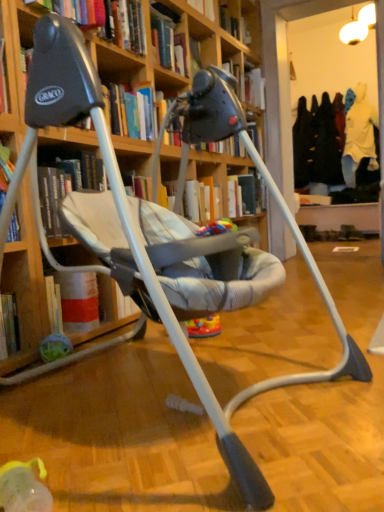
Where is `hardcover book at upper center, which appears as the second book when viewed from the back`? Image resolution: width=384 pixels, height=512 pixels. hardcover book at upper center, which appears as the second book when viewed from the back is located at coordinates (131, 112).

The image size is (384, 512). What do you see at coordinates (217, 228) in the screenshot?
I see `multicolored plastic toy at center` at bounding box center [217, 228].

Measure the distance between point (134, 336) and camera.

Point (134, 336) and camera are 1.67 meters apart from each other.

What do you see at coordinates (249, 84) in the screenshot? I see `hardcover book at upper center, the 1th book positioned from the right` at bounding box center [249, 84].

You are a GUI agent. You are given a task and a screenshot of the screen. Output one action in this format:
    pyautogui.click(x=<x>, y=<y>)
    Task: Click on the hardcover book at upper center, marked as the 1th book in a bottom-to-top arrangement
    
    Given the screenshot: What is the action you would take?
    pyautogui.click(x=131, y=112)

Between hardcover book at upper center, the third book when ordered from left to right, and multicolored plastic toy at center, which one is positioned behind?

hardcover book at upper center, the third book when ordered from left to right, is more distant.

Which is more to the left, hardcover book at upper center, acting as the 1th book starting from the back, or multicolored plastic toy at center?

multicolored plastic toy at center is more to the left.

From a real-world perspective, between hardcover book at upper center, acting as the third book starting from the bottom, and multicolored plastic toy at center, who is vertically higher?

hardcover book at upper center, acting as the third book starting from the bottom.

In the scene shown: From a real-world perspective, relative to hardcover book at upper center, which is the 2th book in front-to-back order, is hardcover book at upper center, the 1th book positioned from the right, vertically above or below?

hardcover book at upper center, the 1th book positioned from the right, is above hardcover book at upper center, which is the 2th book in front-to-back order.

You are a GUI agent. You are given a task and a screenshot of the screen. Output one action in this format:
    pyautogui.click(x=<x>, y=<y>)
    Task: Click on the 2nd book below the hardcover book at upper center, acting as the third book starting from the bottom (from the image's perspective)
    Image resolution: width=384 pixels, height=512 pixels.
    Given the screenshot: What is the action you would take?
    pyautogui.click(x=131, y=112)

Is hardcover book at upper center, acting as the third book starting from the bottom, aimed at hardcover book at upper center, which appears as the second book when viewed from the left?

No, hardcover book at upper center, acting as the third book starting from the bottom, is not aimed at hardcover book at upper center, which appears as the second book when viewed from the left.

From the image's perspective, is hardcover book at upper center, the 1th book positioned from the right, located above or below hardcover book at upper center, which appears as the second book when viewed from the left?

Based on their image positions, hardcover book at upper center, the 1th book positioned from the right, is located above hardcover book at upper center, which appears as the second book when viewed from the left.

From the image's perspective, which object appears higher, hardcover book at upper center, which is the first book in top-to-bottom order, or hardcover book at upper center, which is counted as the 2th book, starting from the top?

hardcover book at upper center, which is the first book in top-to-bottom order, appears higher in the image.

The width and height of the screenshot is (384, 512). There is a hardcover book at upper center, placed as the third book when sorted from back to front. Find the location of `book above it (from a real-world perspective)`. book above it (from a real-world perspective) is located at coordinates (249, 84).

Is hardcover book at upper center, which is the third book in front-to-back order, positioned beyond the bounds of hardcover book at upper center, positioned as the 3th book in right-to-left order?

hardcover book at upper center, which is the third book in front-to-back order, lies outside hardcover book at upper center, positioned as the 3th book in right-to-left order,'s area.

Does hardcover book at upper center, the 1th book positioned from the right, have a larger size compared to hardcover book at upper center, placed as the third book when sorted from back to front?

No, hardcover book at upper center, the 1th book positioned from the right, is not bigger than hardcover book at upper center, placed as the third book when sorted from back to front.

Is hardcover book at upper center, which is the 2th book in front-to-back order, aimed at wooden bookcase at center?

No, hardcover book at upper center, which is the 2th book in front-to-back order, is not facing towards wooden bookcase at center.

Is hardcover book at upper center, which appears as the second book when viewed from the left, to the left or to the right of wooden bookcase at center in the image?

Clearly, hardcover book at upper center, which appears as the second book when viewed from the left, is on the left of wooden bookcase at center in the image.

Which is less distant, [127,130] or [111,340]?

Point [127,130] is positioned farther from the camera compared to point [111,340].

In terms of height, does hardcover book at upper center, which appears as the second book when viewed from the left, look taller or shorter compared to wooden bookcase at center?

hardcover book at upper center, which appears as the second book when viewed from the left, is shorter than wooden bookcase at center.

Does point (224, 222) come closer to viewer compared to point (248, 81)?

Yes, point (224, 222) is closer to viewer.

Can you tell me how much multicolored plastic toy at center and hardcover book at upper center, the third book when ordered from left to right, differ in facing direction?

10.3 degrees separate the facing orientations of multicolored plastic toy at center and hardcover book at upper center, the third book when ordered from left to right.

Between multicolored plastic toy at center and hardcover book at upper center, the third book when ordered from left to right, which one has larger width?

With larger width is hardcover book at upper center, the third book when ordered from left to right.

Considering the sizes of objects multicolored plastic toy at center and hardcover book at upper center, acting as the 1th book starting from the back, in the image provided, who is shorter, multicolored plastic toy at center or hardcover book at upper center, acting as the 1th book starting from the back,?

Standing shorter between the two is multicolored plastic toy at center.

Between hardcover book at upper center, which is counted as the 2th book, starting from the top, and hardcover book at upper center, acting as the third book starting from the bottom, which one has less height?

hardcover book at upper center, which is counted as the 2th book, starting from the top, is shorter.

Is hardcover book at upper center, placed as the second book when sorted from bottom to top, positioned before hardcover book at upper center, acting as the third book starting from the bottom?

Yes, hardcover book at upper center, placed as the second book when sorted from bottom to top, is closer to the camera.

Is hardcover book at upper center, the 1th book positioned from the right, at the back of hardcover book at upper center, positioned as the 3th book in right-to-left order?

No.

Does hardcover book at upper center, which appears as the first book when viewed from the front, have a lesser width compared to hardcover book at upper center, the 1th book positioned from the right?

Incorrect, the width of hardcover book at upper center, which appears as the first book when viewed from the front, is not less than that of hardcover book at upper center, the 1th book positioned from the right.

From the image's perspective, is hardcover book at upper center, placed as the second book when sorted from bottom to top, beneath hardcover book at upper center, marked as the 1th book in a bottom-to-top arrangement?

No.

From a real-world perspective, which object rests below the other?

hardcover book at upper center, marked as the 1th book in a bottom-to-top arrangement.

Is hardcover book at upper center, which appears as the second book when viewed from the left, a part of hardcover book at upper center, positioned as the 1th book in left-to-right order?

No.

Which is in front, point (105, 0) or point (128, 110)?

The point (105, 0) is more forward.

What are the coordinates of `toy in front of the hardcover book at upper center, the 1th book positioned from the right` in the screenshot? It's located at (217, 228).

This screenshot has width=384, height=512. I want to click on book located behind the hardcover book at upper center, which is the 2th book in front-to-back order, so click(x=249, y=84).

Considering their positions, is hardcover book at upper center, which is the third book in front-to-back order, positioned closer to wooden bookcase at center than multicolored plastic toy at center?

Based on the image, multicolored plastic toy at center appears to be nearer to wooden bookcase at center.

Estimate the real-world distances between objects in this image. Which object is further from hardcover book at upper center, marked as the 1th book in a bottom-to-top arrangement, wooden bookcase at center or hardcover book at upper center, placed as the second book when sorted from bottom to top?

wooden bookcase at center is further to hardcover book at upper center, marked as the 1th book in a bottom-to-top arrangement.

From the picture: Looking at the image, which one is located closer to wooden bookcase at center, hardcover book at upper center, placed as the second book when sorted from bottom to top, or multicolored plastic toy at center?

The object closer to wooden bookcase at center is multicolored plastic toy at center.

Looking at the image, which one is located closer to multicolored plastic toy at center, hardcover book at upper center, the 1th book positioned from the right, or hardcover book at upper center, positioned as the 3th book in right-to-left order?

Among the two, hardcover book at upper center, positioned as the 3th book in right-to-left order, is located nearer to multicolored plastic toy at center.

Considering their positions, is hardcover book at upper center, marked as the 1th book in a bottom-to-top arrangement, positioned further to wooden bookcase at center than multicolored plastic toy at center?

hardcover book at upper center, marked as the 1th book in a bottom-to-top arrangement, lies further to wooden bookcase at center than the other object.

Based on the photo, based on their spatial positions, is hardcover book at upper center, which appears as the first book when viewed from the front, or multicolored plastic toy at center closer to hardcover book at upper center, the 1th book positioned from the right?

The object closer to hardcover book at upper center, the 1th book positioned from the right, is hardcover book at upper center, which appears as the first book when viewed from the front.

Estimate the real-world distances between objects in this image. Which object is closer to hardcover book at upper center, which is counted as the 2th book, starting from the top, wooden bookcase at center or hardcover book at upper center, acting as the third book starting from the bottom?

The object closer to hardcover book at upper center, which is counted as the 2th book, starting from the top, is wooden bookcase at center.

Looking at the image, which one is located further to hardcover book at upper center, acting as the third book starting from the bottom, hardcover book at upper center, which appears as the first book when viewed from the front, or wooden bookcase at center?

wooden bookcase at center is further to hardcover book at upper center, acting as the third book starting from the bottom.

I want to click on book between hardcover book at upper center, placed as the third book when sorted from back to front, and multicolored plastic toy at center vertically, so click(131, 112).

In order to click on toy positioned between wooden bookcase at center and hardcover book at upper center, acting as the 1th book starting from the back, from near to far in this screenshot , I will do `click(217, 228)`.

The height and width of the screenshot is (512, 384). Find the location of `book located between wooden bookcase at center and hardcover book at upper center, arranged as the second book when viewed from the right, in the depth direction`. book located between wooden bookcase at center and hardcover book at upper center, arranged as the second book when viewed from the right, in the depth direction is located at coordinates (104, 19).

What are the coordinates of `toy positioned between wooden bookcase at center and hardcover book at upper center, which appears as the second book when viewed from the back, from near to far` in the screenshot? It's located at (217, 228).